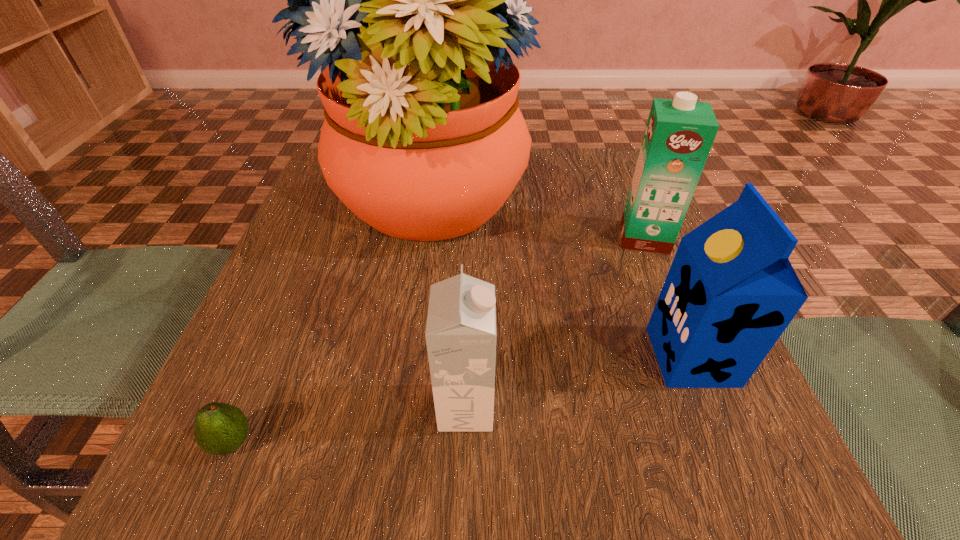
Image resolution: width=960 pixels, height=540 pixels. I want to click on flower arrangement located at the left edge, so click(x=408, y=0).

I want to click on avocado situated at the left edge, so click(x=219, y=429).

At what (x,y) coordinates should I click in order to perform the action: click on object at the far left corner. Please return your answer as a coordinate pair (x, y). Looking at the image, I should click on (408, 0).

Identify the location of object situated at the near left corner. (219, 429).

The image size is (960, 540). In the image, there is a desktop. Find the location of `vacant space at the far edge`. vacant space at the far edge is located at coordinates (536, 184).

I want to click on blank space at the near edge of the desktop, so pyautogui.click(x=419, y=487).

The height and width of the screenshot is (540, 960). I want to click on vacant space at the left edge, so tap(306, 429).

The width and height of the screenshot is (960, 540). Identify the location of free spot at the right edge of the desktop. (675, 253).

I want to click on free space at the near left corner of the desktop, so click(x=241, y=506).

Locate an element on the screen. This screenshot has height=540, width=960. vacant space at the far right corner of the desktop is located at coordinates (588, 148).